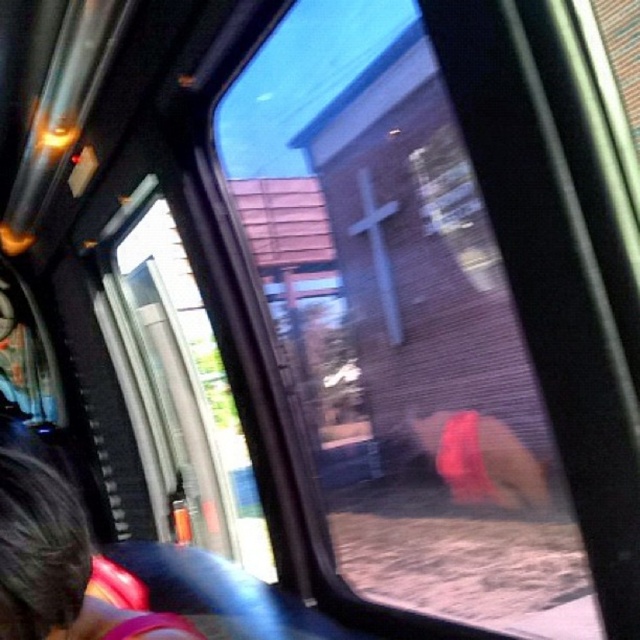
Question: Does transparent glass window at center appear over dark brown hair at lower left?

Choices:
 (A) yes
 (B) no

Answer: (B)

Question: Among these points, which one is farthest from the camera?

Choices:
 (A) (172, 292)
 (B) (80, 504)

Answer: (A)

Question: Is transparent glass window at center behind dark brown hair at lower left?

Choices:
 (A) no
 (B) yes

Answer: (B)

Question: Where is transparent glass window at center located in relation to dark brown hair at lower left in the image?

Choices:
 (A) above
 (B) below

Answer: (B)